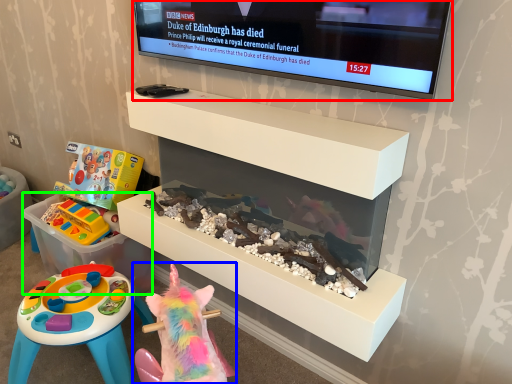
Question: Which is farther away from television (highlighted by a red box)? toy (highlighted by a blue box) or storage box (highlighted by a green box)?

Choices:
 (A) toy
 (B) storage box

Answer: (B)